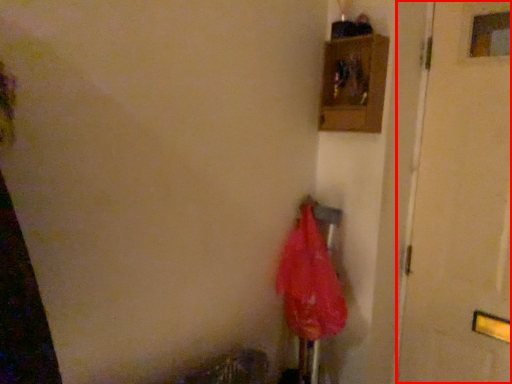
Question: From the image's perspective, what is the correct spatial relationship of door (annotated by the red box) in relation to umbrella?

Choices:
 (A) below
 (B) above

Answer: (B)